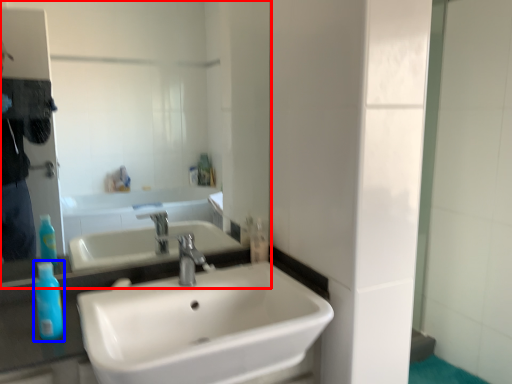
Question: Which object is further to the camera taking this photo, mirror (highlighted by a red box) or mouthwash (highlighted by a blue box)?

Choices:
 (A) mirror
 (B) mouthwash

Answer: (A)